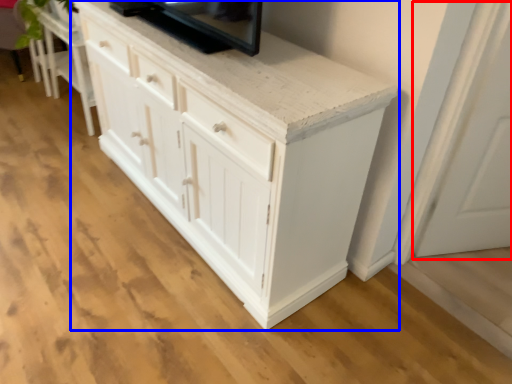
Question: Which object appears closest to the camera in this image, glass door (highlighted by a red box) or chest of drawers (highlighted by a blue box)?

Choices:
 (A) glass door
 (B) chest of drawers

Answer: (B)